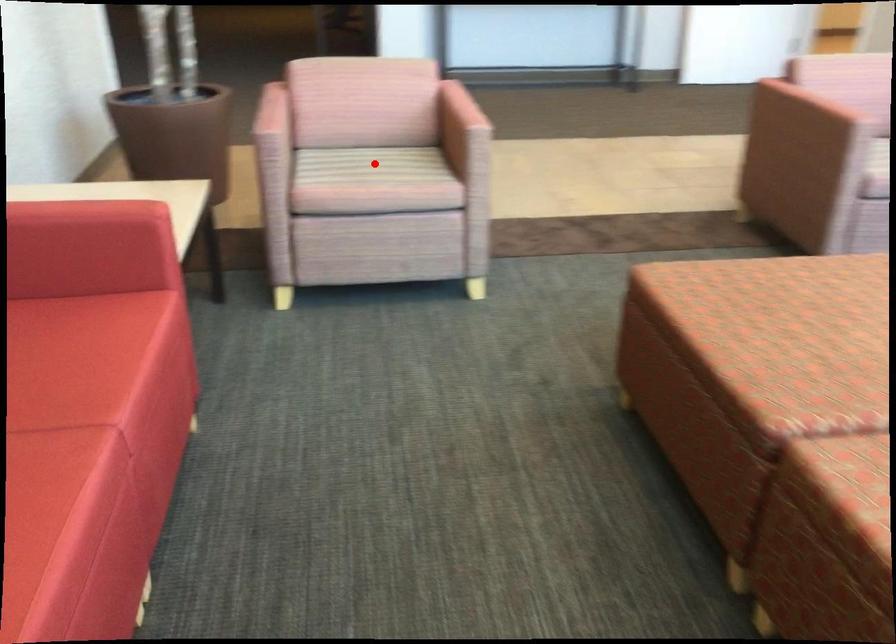
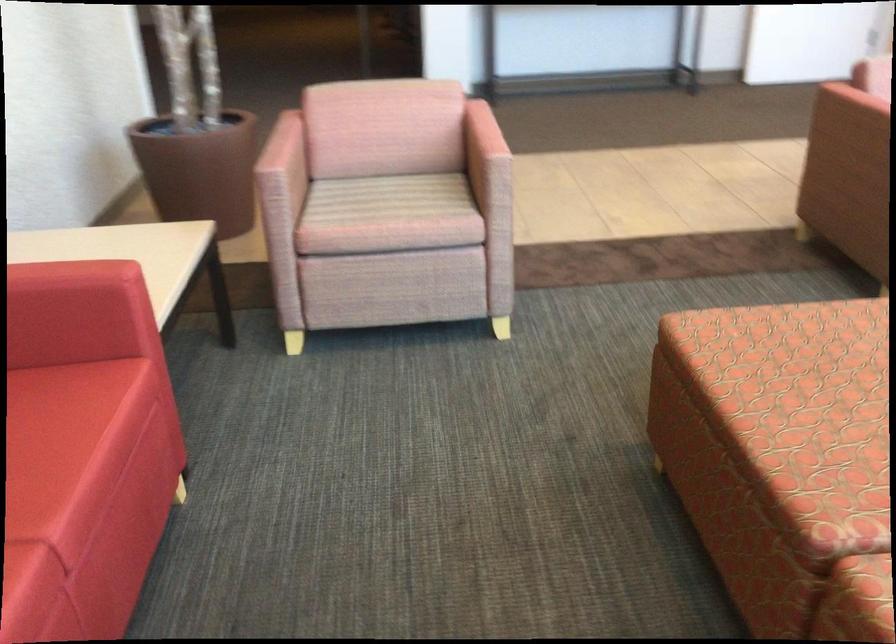
Where in the second image is the point corresponding to the highlighted location from the first image?

(389, 198)